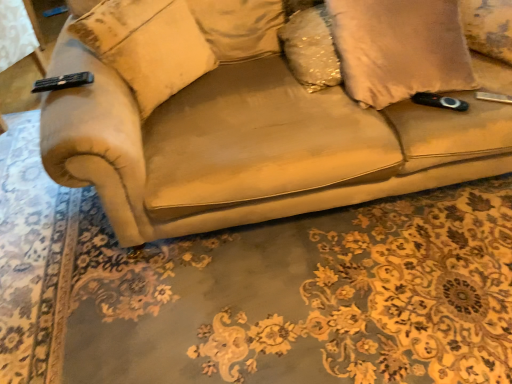
The height and width of the screenshot is (384, 512). Describe the element at coordinates (399, 49) in the screenshot. I see `suede-like beige pillow at right, which is counted as the second pillow, starting from the right` at that location.

What is the approximate width of suede-like beige pillow at right, which is counted as the second pillow, starting from the right?

It is 18.64 inches.

The height and width of the screenshot is (384, 512). Describe the element at coordinates (145, 45) in the screenshot. I see `beige fabric pillow at left, which is the first pillow in left-to-right order` at that location.

Where is `sparkly gold pillow at upper center, which ranks as the third pillow in right-to-left order`? The height and width of the screenshot is (384, 512). sparkly gold pillow at upper center, which ranks as the third pillow in right-to-left order is located at coordinates (311, 48).

In order to face sparkly gold pillow at upper center, which ranks as the third pillow in right-to-left order, should I rotate leftwards or rightwards?

Rotate right and turn 9.434 degrees.

Where is `suede-like beige pillow at right, which is counted as the second pillow, starting from the right`? suede-like beige pillow at right, which is counted as the second pillow, starting from the right is located at coordinates (399, 49).

From a real-world perspective, which object stands above the other?

In real-world perspective, suede-like beige pillow at upper right, which ranks as the 1th pillow in right-to-left order, is above.

Is point (499, 58) more distant than point (297, 38)?

Yes, point (499, 58) is behind point (297, 38).

From the image's perspective, is suede-like beige pillow at upper right, which ranks as the 1th pillow in right-to-left order, above sparkly gold pillow at upper center, the second pillow positioned from the left?

Correct, suede-like beige pillow at upper right, which ranks as the 1th pillow in right-to-left order, appears higher than sparkly gold pillow at upper center, the second pillow positioned from the left, in the image.

How different are the orientations of suede-like beige pillow at upper right, which is the 4th pillow from left to right, and sparkly gold pillow at upper center, which ranks as the third pillow in right-to-left order, in degrees?

They differ by 54.6 degrees in their facing directions.

Based on the photo, is beige fabric pillow at left, which is the first pillow in left-to-right order, thinner than suede-like beige pillow at right, positioned as the 3th pillow in left-to-right order?

Indeed, beige fabric pillow at left, which is the first pillow in left-to-right order, has a lesser width compared to suede-like beige pillow at right, positioned as the 3th pillow in left-to-right order.

Find the location of `pillow that is the 2nd one when counting leftward from the suede-like beige pillow at right, positioned as the 3th pillow in left-to-right order`. pillow that is the 2nd one when counting leftward from the suede-like beige pillow at right, positioned as the 3th pillow in left-to-right order is located at coordinates (145, 45).

Consider the image. Does beige fabric pillow at left, which is the first pillow in left-to-right order, have a smaller size compared to suede-like beige pillow at right, which is counted as the second pillow, starting from the right?

Correct, beige fabric pillow at left, which is the first pillow in left-to-right order, occupies less space than suede-like beige pillow at right, which is counted as the second pillow, starting from the right.

Between beige fabric pillow at left, positioned as the fourth pillow in right-to-left order, and suede-like beige pillow at right, positioned as the 3th pillow in left-to-right order, which one has less height?

suede-like beige pillow at right, positioned as the 3th pillow in left-to-right order.

From the image's perspective, which one is positioned higher, suede-like beige pillow at right, positioned as the 3th pillow in left-to-right order, or beige fabric pillow at left, which is the first pillow in left-to-right order?

suede-like beige pillow at right, positioned as the 3th pillow in left-to-right order.

Which is closer to the camera, (388, 65) or (178, 53)?

Answer: Positioned in front is point (388, 65).

Considering the sizes of suede-like beige pillow at right, which is counted as the second pillow, starting from the right, and beige fabric pillow at left, which is the first pillow in left-to-right order, in the image, is suede-like beige pillow at right, which is counted as the second pillow, starting from the right, taller or shorter than beige fabric pillow at left, which is the first pillow in left-to-right order,?

Considering their sizes, suede-like beige pillow at right, which is counted as the second pillow, starting from the right, has less height than beige fabric pillow at left, which is the first pillow in left-to-right order.

In terms of height, does beige fabric pillow at left, positioned as the fourth pillow in right-to-left order, look taller or shorter compared to suede-like beige pillow at upper right, which is the 4th pillow from left to right?

Considering their sizes, beige fabric pillow at left, positioned as the fourth pillow in right-to-left order, has more height than suede-like beige pillow at upper right, which is the 4th pillow from left to right.

Considering the sizes of objects beige fabric pillow at left, which is the first pillow in left-to-right order, and suede-like beige pillow at upper right, which is the 4th pillow from left to right, in the image provided, who is smaller, beige fabric pillow at left, which is the first pillow in left-to-right order, or suede-like beige pillow at upper right, which is the 4th pillow from left to right,?

suede-like beige pillow at upper right, which is the 4th pillow from left to right, is smaller.

Is beige fabric pillow at left, which is the first pillow in left-to-right order, located outside suede-like beige pillow at upper right, which is the 4th pillow from left to right?

Yes, beige fabric pillow at left, which is the first pillow in left-to-right order, is outside of suede-like beige pillow at upper right, which is the 4th pillow from left to right.

From the image's perspective, which is above, beige fabric pillow at left, which is the first pillow in left-to-right order, or suede-like beige pillow at upper right, which ranks as the 1th pillow in right-to-left order?

suede-like beige pillow at upper right, which ranks as the 1th pillow in right-to-left order, is shown above in the image.

Between sparkly gold pillow at upper center, which ranks as the third pillow in right-to-left order, and suede-like beige pillow at right, which is counted as the second pillow, starting from the right, which one has smaller size?

Smaller between the two is sparkly gold pillow at upper center, which ranks as the third pillow in right-to-left order.

Is sparkly gold pillow at upper center, which ranks as the third pillow in right-to-left order, shorter than suede-like beige pillow at right, positioned as the 3th pillow in left-to-right order?

Correct, sparkly gold pillow at upper center, which ranks as the third pillow in right-to-left order, is not as tall as suede-like beige pillow at right, positioned as the 3th pillow in left-to-right order.

Is point (309, 43) in front of point (417, 83)?

No, it is behind (417, 83).

Is sparkly gold pillow at upper center, the second pillow positioned from the left, facing towards suede-like beige pillow at right, positioned as the 3th pillow in left-to-right order?

Yes, sparkly gold pillow at upper center, the second pillow positioned from the left, is turned towards suede-like beige pillow at right, positioned as the 3th pillow in left-to-right order.

Is suede-like beige pillow at right, which is counted as the second pillow, starting from the right, smaller than sparkly gold pillow at upper center, which ranks as the third pillow in right-to-left order?

No, suede-like beige pillow at right, which is counted as the second pillow, starting from the right, is not smaller than sparkly gold pillow at upper center, which ranks as the third pillow in right-to-left order.

Would you say suede-like beige pillow at right, which is counted as the second pillow, starting from the right, is inside or outside sparkly gold pillow at upper center, which ranks as the third pillow in right-to-left order?

suede-like beige pillow at right, which is counted as the second pillow, starting from the right, cannot be found inside sparkly gold pillow at upper center, which ranks as the third pillow in right-to-left order.

Are suede-like beige pillow at right, which is counted as the second pillow, starting from the right, and sparkly gold pillow at upper center, which ranks as the third pillow in right-to-left order, far apart?

suede-like beige pillow at right, which is counted as the second pillow, starting from the right, is near sparkly gold pillow at upper center, which ranks as the third pillow in right-to-left order, not far away.

Does suede-like beige pillow at right, positioned as the 3th pillow in left-to-right order, have a lesser width compared to sparkly gold pillow at upper center, the second pillow positioned from the left?

No.

Which object is further away from the camera, suede-like beige pillow at upper right, which ranks as the 1th pillow in right-to-left order, or suede-like beige pillow at right, positioned as the 3th pillow in left-to-right order?

Positioned behind is suede-like beige pillow at upper right, which ranks as the 1th pillow in right-to-left order.

From a real-world perspective, who is located higher, suede-like beige pillow at upper right, which ranks as the 1th pillow in right-to-left order, or suede-like beige pillow at right, positioned as the 3th pillow in left-to-right order?

suede-like beige pillow at right, positioned as the 3th pillow in left-to-right order.

How different are the orientations of suede-like beige pillow at upper right, which ranks as the 1th pillow in right-to-left order, and suede-like beige pillow at right, positioned as the 3th pillow in left-to-right order, in degrees?

They differ by 45.6 degrees in their facing directions.

Is suede-like beige pillow at upper right, which ranks as the 1th pillow in right-to-left order, positioned far away from suede-like beige pillow at right, which is counted as the second pillow, starting from the right?

suede-like beige pillow at upper right, which ranks as the 1th pillow in right-to-left order, is actually quite close to suede-like beige pillow at right, which is counted as the second pillow, starting from the right.

Identify the location of pillow lying behind the sparkly gold pillow at upper center, the second pillow positioned from the left. Image resolution: width=512 pixels, height=384 pixels. (488, 27).

Locate an element on the screen. Image resolution: width=512 pixels, height=384 pixels. pillow that appears above the suede-like beige pillow at right, which is counted as the second pillow, starting from the right (from a real-world perspective) is located at coordinates (145, 45).

Considering their positions, is sparkly gold pillow at upper center, the second pillow positioned from the left, positioned closer to beige fabric pillow at left, which is the first pillow in left-to-right order, than suede-like beige pillow at upper right, which ranks as the 1th pillow in right-to-left order?

sparkly gold pillow at upper center, the second pillow positioned from the left.

Looking at the image, which one is located further to sparkly gold pillow at upper center, which ranks as the third pillow in right-to-left order, suede-like beige pillow at upper right, which ranks as the 1th pillow in right-to-left order, or beige fabric pillow at left, positioned as the fourth pillow in right-to-left order?

suede-like beige pillow at upper right, which ranks as the 1th pillow in right-to-left order, is positioned further to the anchor sparkly gold pillow at upper center, which ranks as the third pillow in right-to-left order.

Based on their spatial positions, is beige fabric pillow at left, positioned as the fourth pillow in right-to-left order, or suede-like beige pillow at upper right, which is the 4th pillow from left to right, closer to sparkly gold pillow at upper center, which ranks as the third pillow in right-to-left order?

Among the two, beige fabric pillow at left, positioned as the fourth pillow in right-to-left order, is located nearer to sparkly gold pillow at upper center, which ranks as the third pillow in right-to-left order.

Estimate the real-world distances between objects in this image. Which object is closer to suede-like beige pillow at upper right, which is the 4th pillow from left to right, sparkly gold pillow at upper center, which ranks as the third pillow in right-to-left order, or beige fabric pillow at left, positioned as the fourth pillow in right-to-left order?

sparkly gold pillow at upper center, which ranks as the third pillow in right-to-left order.

Looking at the image, which one is located further to sparkly gold pillow at upper center, the second pillow positioned from the left, suede-like beige pillow at right, positioned as the 3th pillow in left-to-right order, or beige fabric pillow at left, positioned as the fourth pillow in right-to-left order?

Among the two, beige fabric pillow at left, positioned as the fourth pillow in right-to-left order, is located further to sparkly gold pillow at upper center, the second pillow positioned from the left.

Looking at the image, which one is located further to beige fabric pillow at left, which is the first pillow in left-to-right order, sparkly gold pillow at upper center, the second pillow positioned from the left, or suede-like beige pillow at right, positioned as the 3th pillow in left-to-right order?

suede-like beige pillow at right, positioned as the 3th pillow in left-to-right order, is positioned further to the anchor beige fabric pillow at left, which is the first pillow in left-to-right order.

Based on their spatial positions, is suede-like beige pillow at upper right, which ranks as the 1th pillow in right-to-left order, or suede-like beige pillow at right, which is counted as the second pillow, starting from the right, further from sparkly gold pillow at upper center, which ranks as the third pillow in right-to-left order?

Among the two, suede-like beige pillow at upper right, which ranks as the 1th pillow in right-to-left order, is located further to sparkly gold pillow at upper center, which ranks as the third pillow in right-to-left order.

Estimate the real-world distances between objects in this image. Which object is further from suede-like beige pillow at right, which is counted as the second pillow, starting from the right, beige fabric pillow at left, positioned as the fourth pillow in right-to-left order, or suede-like beige pillow at upper right, which is the 4th pillow from left to right?

beige fabric pillow at left, positioned as the fourth pillow in right-to-left order.

Identify the location of pillow between sparkly gold pillow at upper center, the second pillow positioned from the left, and suede-like beige pillow at upper right, which is the 4th pillow from left to right, from left to right. This screenshot has height=384, width=512. (399, 49).

The height and width of the screenshot is (384, 512). I want to click on pillow between beige fabric pillow at left, positioned as the fourth pillow in right-to-left order, and suede-like beige pillow at right, positioned as the 3th pillow in left-to-right order, in the horizontal direction, so click(x=311, y=48).